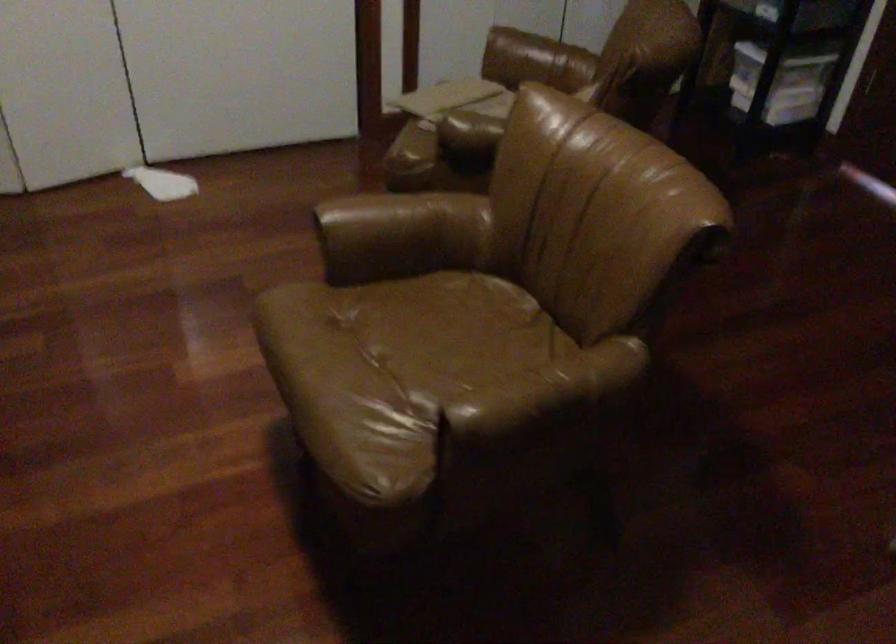
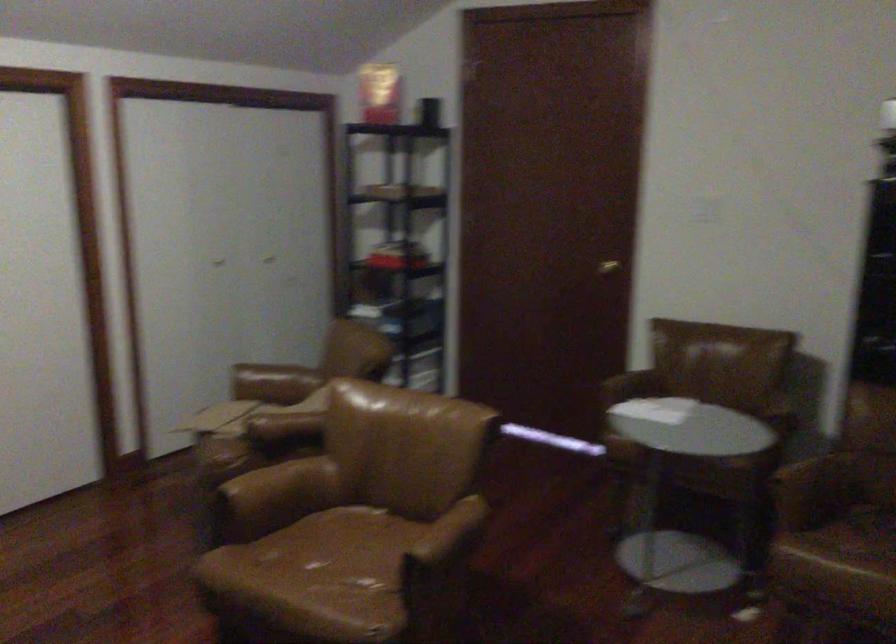
Find the pixel in the second image that matches the point at 414,216 in the first image.

(280, 484)